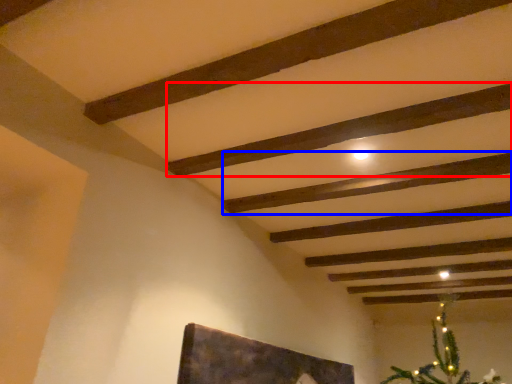
Question: Which object is closer to the camera taking this photo, plank (highlighted by a red box) or plank (highlighted by a blue box)?

Choices:
 (A) plank
 (B) plank

Answer: (A)